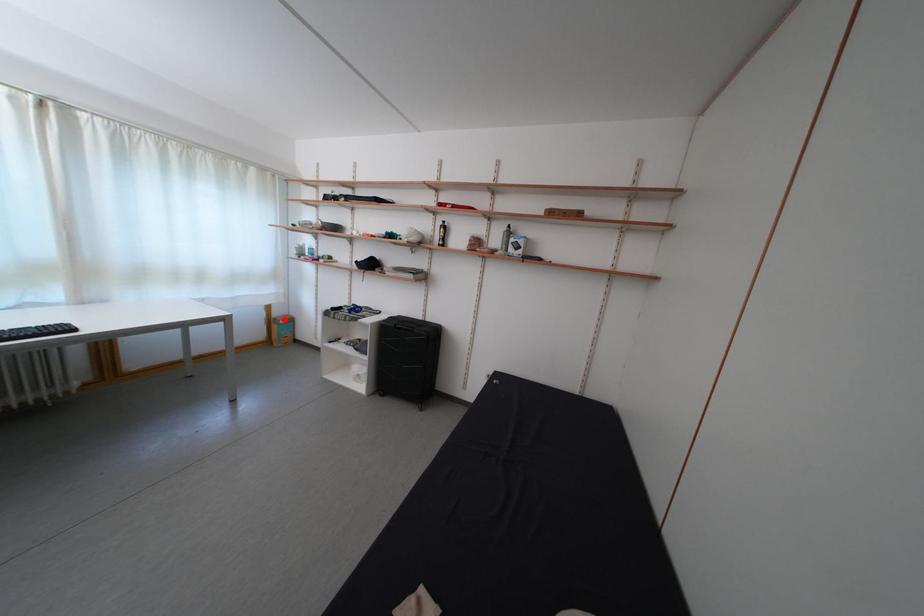
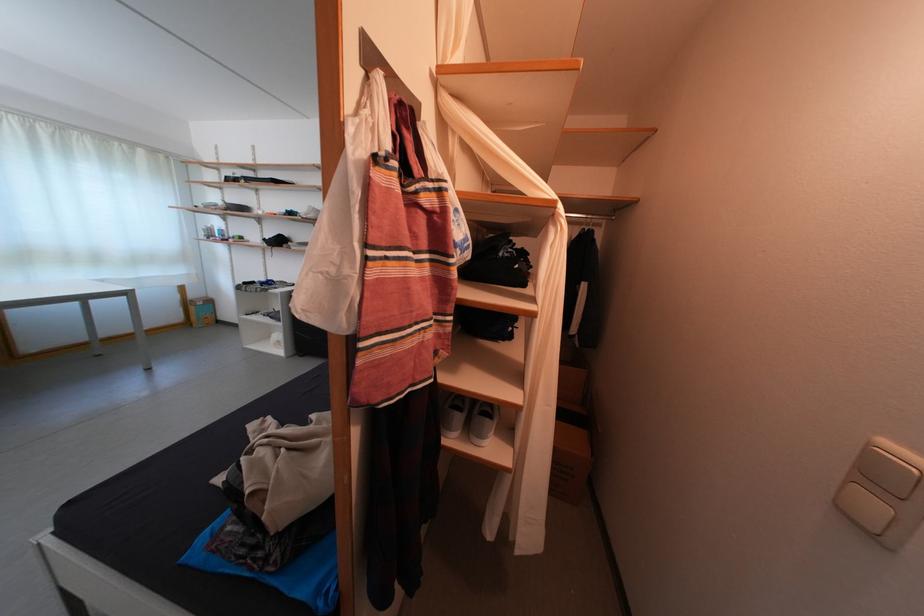
Locate, in the second image, the point that corresponds to the highlighted location in the first image.

(201, 302)